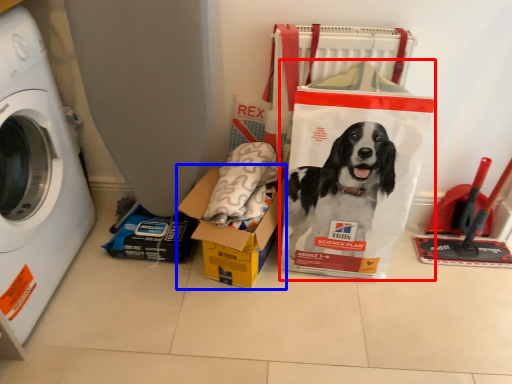
Question: Which object is further to the camera taking this photo, paper bag (highlighted by a red box) or box (highlighted by a blue box)?

Choices:
 (A) paper bag
 (B) box

Answer: (B)